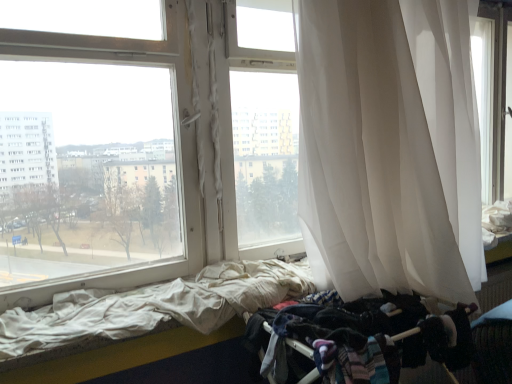
Question: Can white fabric bed at lower left be found inside white sheer curtain at right?

Choices:
 (A) yes
 (B) no

Answer: (B)

Question: Is white sheer curtain at right positioned before white fabric bed at lower left?

Choices:
 (A) no
 (B) yes

Answer: (B)

Question: Is white sheer curtain at right thinner than white fabric bed at lower left?

Choices:
 (A) no
 (B) yes

Answer: (A)

Question: Is white sheer curtain at right facing away from white fabric bed at lower left?

Choices:
 (A) no
 (B) yes

Answer: (B)

Question: From the image's perspective, is white sheer curtain at right located above white fabric bed at lower left?

Choices:
 (A) yes
 (B) no

Answer: (A)

Question: Considering the positions of dark fabric baby carriage at lower right and white fabric bed at lower left in the image, is dark fabric baby carriage at lower right wider or thinner than white fabric bed at lower left?

Choices:
 (A) thin
 (B) wide

Answer: (B)

Question: From the image's perspective, is dark fabric baby carriage at lower right located above or below white fabric bed at lower left?

Choices:
 (A) below
 (B) above

Answer: (A)

Question: Based on their sizes in the image, would you say dark fabric baby carriage at lower right is bigger or smaller than white fabric bed at lower left?

Choices:
 (A) small
 (B) big

Answer: (B)

Question: Is dark fabric baby carriage at lower right inside the boundaries of white fabric bed at lower left, or outside?

Choices:
 (A) inside
 (B) outside

Answer: (B)

Question: In the image, is white sheer curtain at right on the left side or the right side of dark fabric baby carriage at lower right?

Choices:
 (A) left
 (B) right

Answer: (B)

Question: Is white sheer curtain at right in front of or behind dark fabric baby carriage at lower right in the image?

Choices:
 (A) front
 (B) behind

Answer: (A)

Question: Is point (349, 274) closer or farther from the camera than point (352, 331)?

Choices:
 (A) closer
 (B) farther

Answer: (B)

Question: From the image's perspective, is white sheer curtain at right above or below dark fabric baby carriage at lower right?

Choices:
 (A) above
 (B) below

Answer: (A)

Question: Considering the positions of white sheer curtain at right and white fabric bed at lower left in the image, is white sheer curtain at right taller or shorter than white fabric bed at lower left?

Choices:
 (A) tall
 (B) short

Answer: (A)

Question: In the image, is white sheer curtain at right positioned in front of or behind white fabric bed at lower left?

Choices:
 (A) behind
 (B) front

Answer: (B)